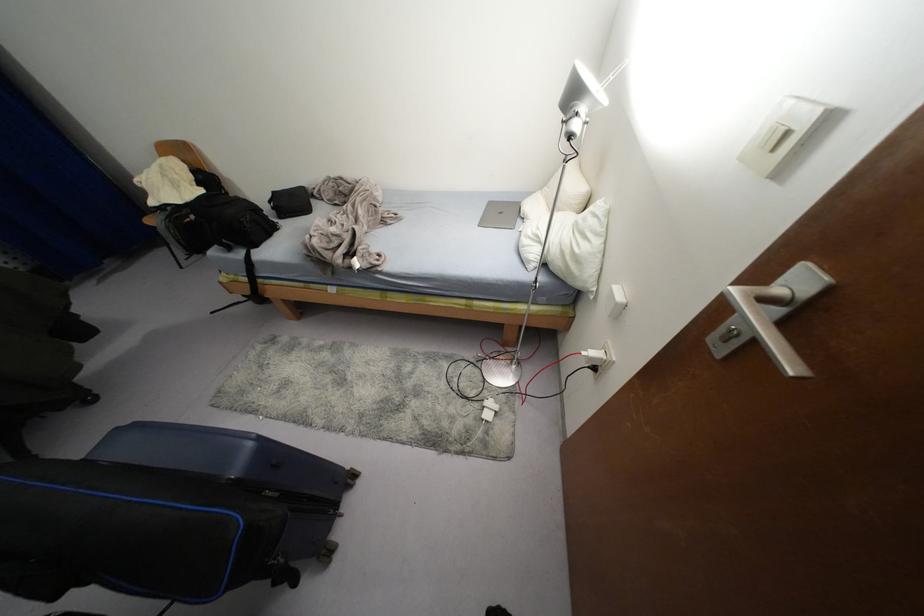
Identify the location of silver door handle. (768, 325).